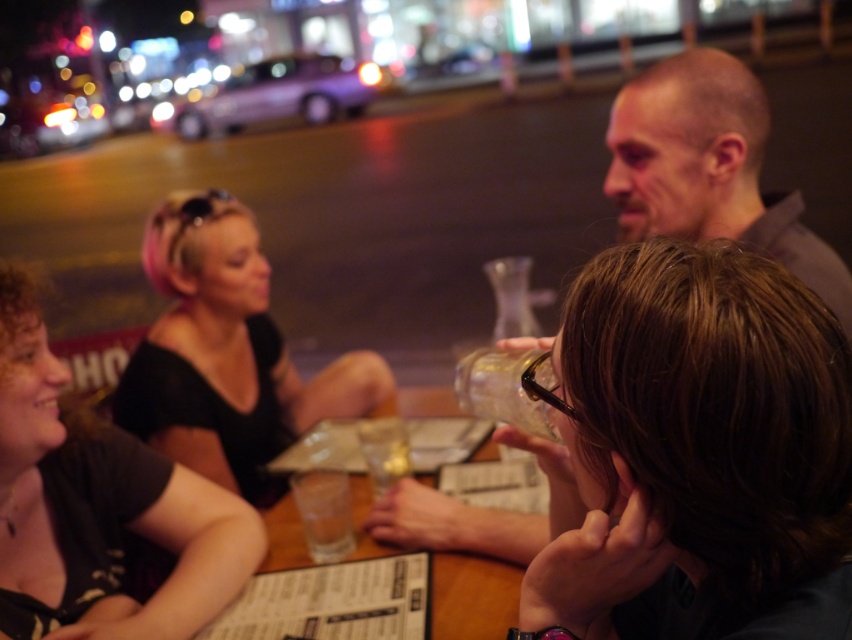
Question: Can you confirm if smooth gray shirt at center is positioned to the right of transparent glass bottle at center?

Choices:
 (A) no
 (B) yes

Answer: (B)

Question: Estimate the real-world distances between objects in this image. Which object is farther from the brown hair at center?

Choices:
 (A) transparent glass bottle at center
 (B) pink hair at center
 (C) wooden table at center

Answer: (B)

Question: Does black matte shirt at lower left appear under transparent glass at center?

Choices:
 (A) no
 (B) yes

Answer: (A)

Question: Observing the image, what is the correct spatial positioning of black matte shirt at lower left in reference to smooth gray shirt at center?

Choices:
 (A) right
 (B) left

Answer: (B)

Question: Estimate the real-world distances between objects in this image. Which object is farther from the brown hair at center?

Choices:
 (A) black matte shirt at lower left
 (B) smooth gray shirt at center
 (C) wooden table at center
 (D) transparent glass at center

Answer: (A)

Question: Which object is farther from the camera taking this photo?

Choices:
 (A) black matte shirt at lower left
 (B) pink hair at center
 (C) wooden table at center
 (D) brown hair at center

Answer: (B)